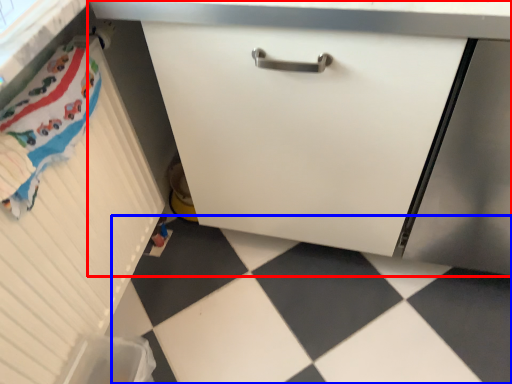
Question: Which point is further to the camera, cabinetry (highlighted by a red box) or tile (highlighted by a blue box)?

Choices:
 (A) cabinetry
 (B) tile

Answer: (B)